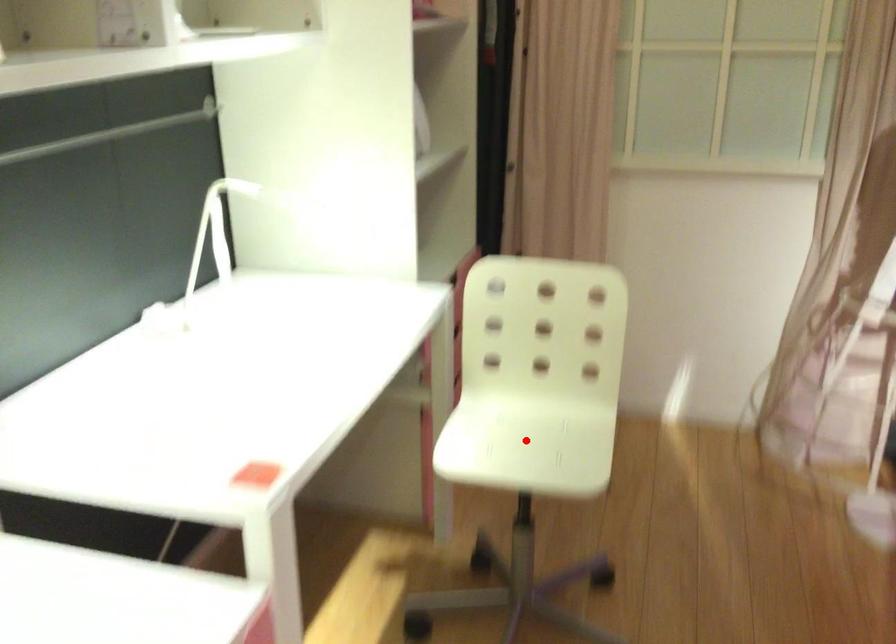
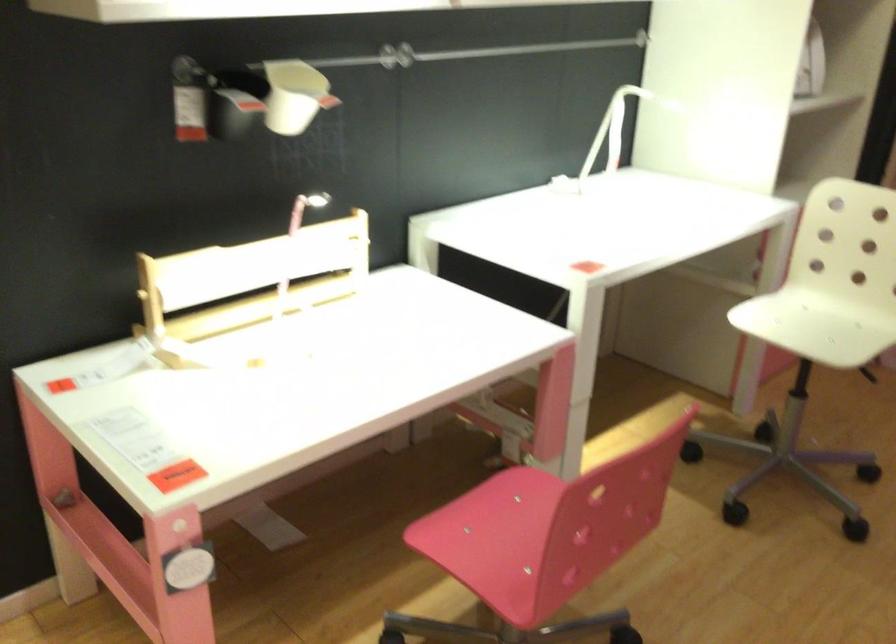
Question: A red point is marked in image1. In image2, is the corresponding 3D point closer to the camera or farther? Reply with the corresponding letter.

Choices:
 (A) The corresponding 3D point is closer.
 (B) The corresponding 3D point is farther.

Answer: (B)